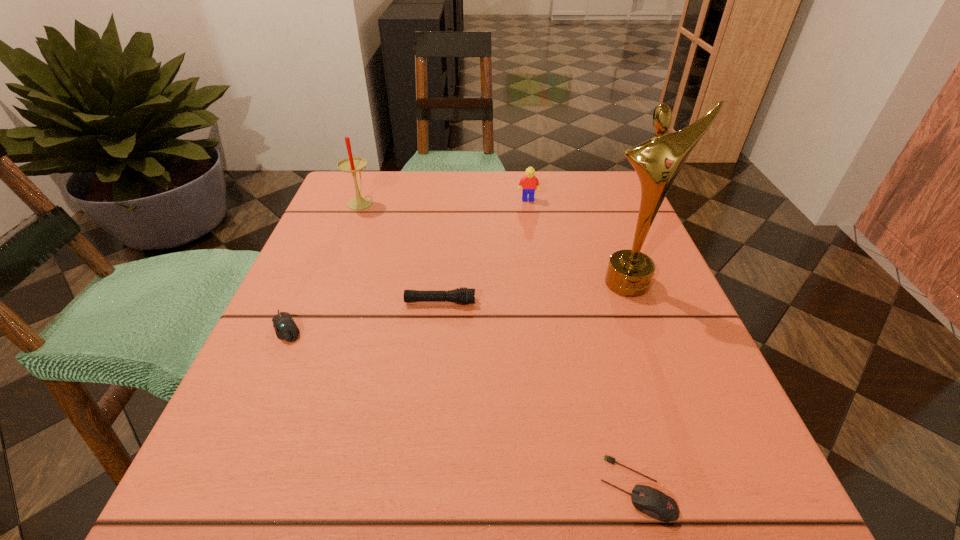
You are a GUI agent. You are given a task and a screenshot of the screen. Output one action in this format:
    pyautogui.click(x=<x>, y=<y>)
    Task: Click on the free space between the second tallest object and the fourth shortest object
    
    Given the screenshot: What is the action you would take?
    click(x=444, y=201)

Where is `free point between the nearer mouse and the fifth farthest object`? The width and height of the screenshot is (960, 540). free point between the nearer mouse and the fifth farthest object is located at coordinates (462, 408).

The image size is (960, 540). In order to click on the fourth closest object to the tallest object in this screenshot , I will do `click(352, 164)`.

Find the location of `the closest object relative to the nearer mouse`. the closest object relative to the nearer mouse is located at coordinates (657, 161).

This screenshot has height=540, width=960. I want to click on free space that satisfies the following two spatial constraints: 1. on the front-facing side of the fourth shortest object; 2. at the lens end of the fourth tallest object, so click(x=544, y=302).

Find the location of a particular element. vacant position in the image that satisfies the following two spatial constraints: 1. on the front-facing side of the award; 2. at the lens end of the fourth object from right to left is located at coordinates (636, 302).

Locate an element on the screen. vacant space that satisfies the following two spatial constraints: 1. at the lens end of the fourth object from right to left; 2. on the front side of the farther mouse is located at coordinates tap(438, 327).